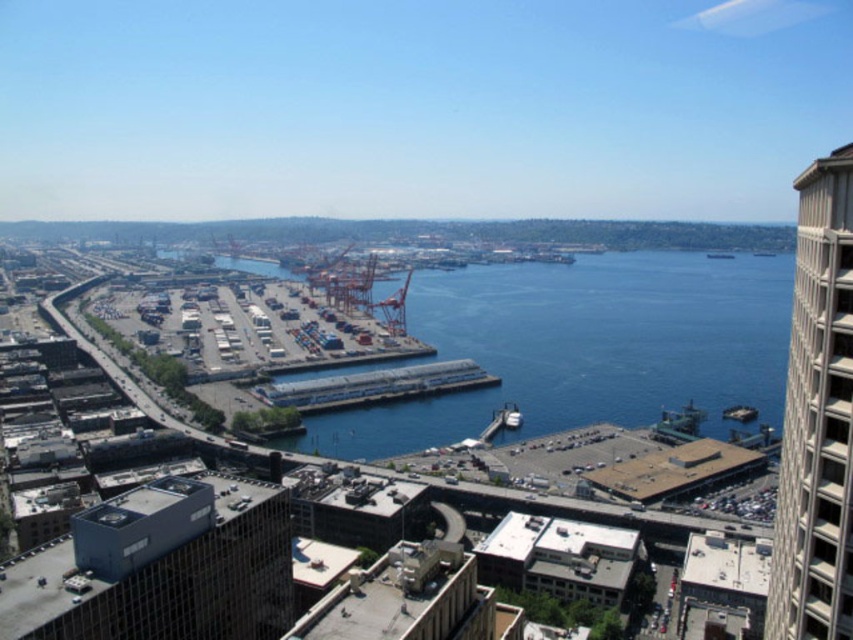
You are a drone operator tasked with delivering a package to the white concrete dock at center. Your drone has a maximum range of 400 meters. Can the drone safely reach the dock from your current position?

The distance between the white concrete dock at center and the camera is 390.92 meters, which is within the drone operator drone has a maximum range of 400 meters. The drone can safely reach the white concrete dock at center.

You are a city planner analyzing the urban layout. Based on the aerial view, which object is positioned higher in the scene between the blue water at center and the metallic silver boat at center?

The blue water at center is positioned higher than the metallic silver boat at center in the scene.